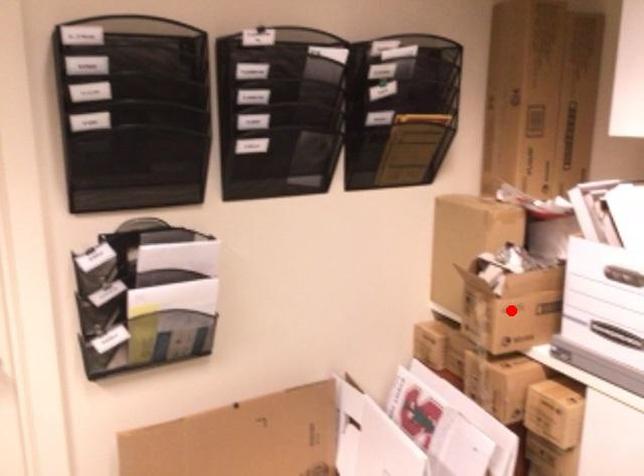
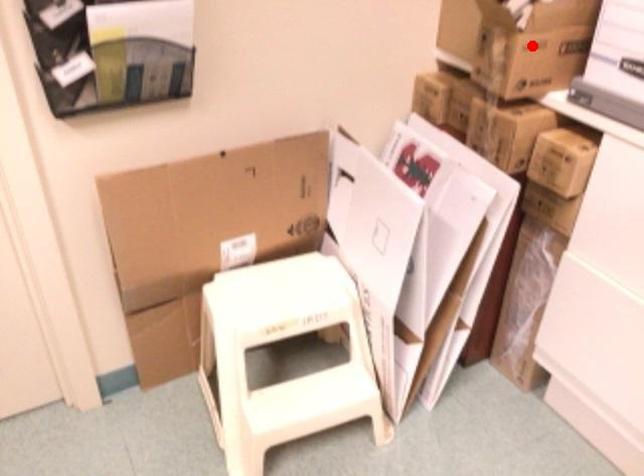
I am providing you with two images of the same scene from different viewpoints. A red point is marked on the first image and another point is marked on the second image. Are the points marked in image1 and image2 representing the same 3D position?

Yes